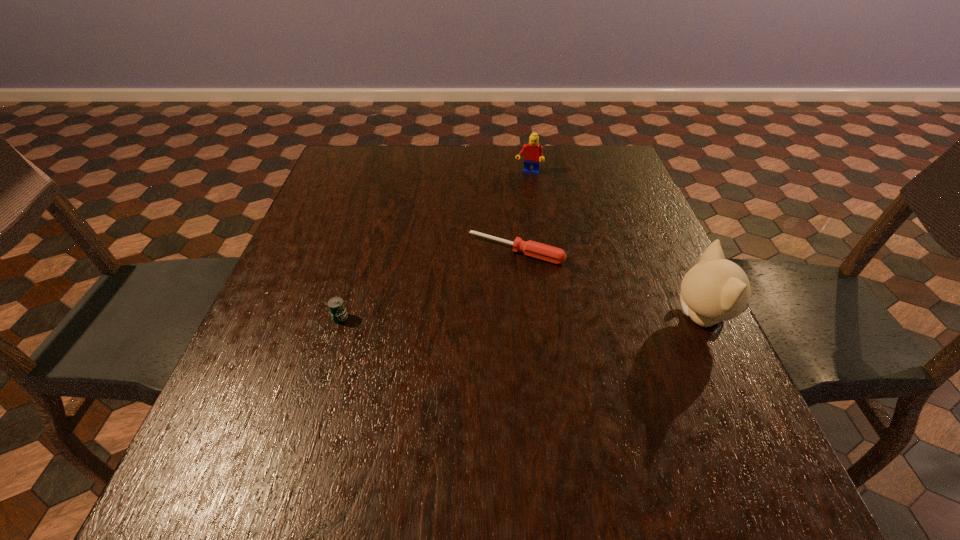
In the image, there is a desktop. Where is `vacant space at the left edge`? The width and height of the screenshot is (960, 540). vacant space at the left edge is located at coordinates (332, 330).

I want to click on vacant space at the right edge of the desktop, so click(x=629, y=296).

Identify the location of free location at the far left corner. point(365,166).

Identify the location of free spot at the far right corner of the desktop. pos(579,161).

In the image, there is a desktop. Where is `blank space at the near right corner`? blank space at the near right corner is located at coordinates (711, 442).

What are the coordinates of `vacant area that lies between the third nearest object and the Lego` in the screenshot? It's located at (522, 212).

I want to click on vacant area that lies between the screwdriver and the Lego, so click(x=522, y=212).

At what (x,y) coordinates should I click in order to perform the action: click on free point between the second shortest object and the tallest object. Please return your answer as a coordinate pair (x, y). The image size is (960, 540). Looking at the image, I should click on (520, 318).

Locate an element on the screen. The width and height of the screenshot is (960, 540). vacant area between the Lego and the shortest object is located at coordinates (522, 212).

Image resolution: width=960 pixels, height=540 pixels. In order to click on free spot between the farthest object and the tallest object in this screenshot , I will do `click(614, 246)`.